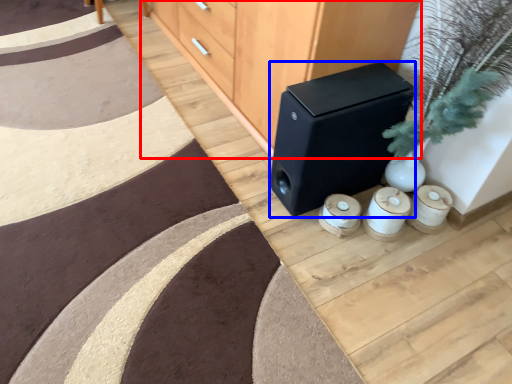
Question: Among these objects, which one is farthest to the camera, furniture (highlighted by a red box) or speaker (highlighted by a blue box)?

Choices:
 (A) furniture
 (B) speaker

Answer: (B)